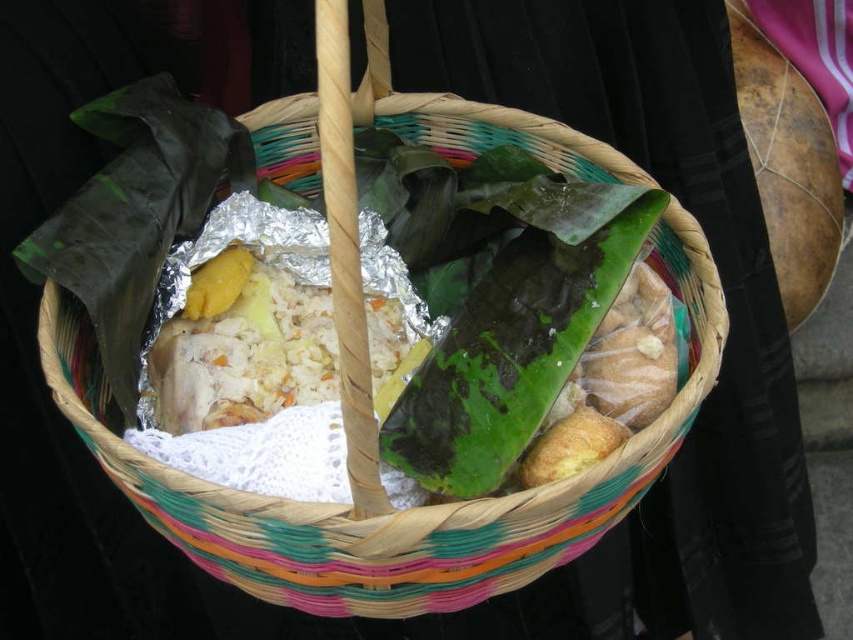
Question: Which of the following is the closest to the observer?

Choices:
 (A) (253, 300)
 (B) (602, 275)

Answer: (B)

Question: Can you confirm if green matte banana leaf at center is positioned to the right of white rice at center?

Choices:
 (A) yes
 (B) no

Answer: (A)

Question: Can you confirm if green matte banana leaf at center is positioned above white rice at center?

Choices:
 (A) no
 (B) yes

Answer: (B)

Question: Does green matte banana leaf at center have a smaller size compared to white rice at center?

Choices:
 (A) no
 (B) yes

Answer: (A)